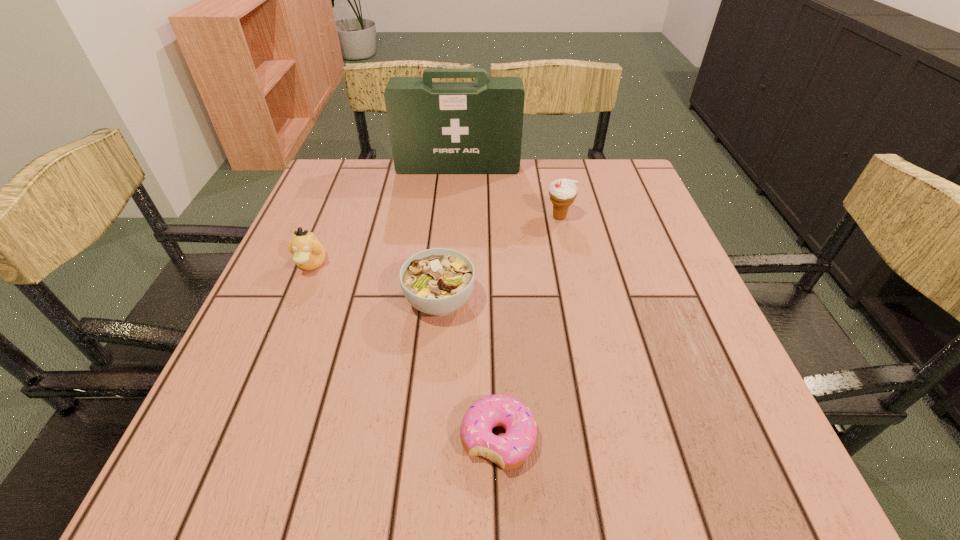
I want to click on the farthest object, so click(x=435, y=127).

The image size is (960, 540). What are the coordinates of `the first-aid kit` in the screenshot? It's located at (435, 127).

At what (x,y) coordinates should I click in order to perform the action: click on icecream. Please return your answer as a coordinate pair (x, y). The height and width of the screenshot is (540, 960). Looking at the image, I should click on 563,192.

Where is `the fourth nearest object`? The width and height of the screenshot is (960, 540). the fourth nearest object is located at coordinates (563, 192).

Where is `the leftmost object`? This screenshot has width=960, height=540. the leftmost object is located at coordinates (309, 254).

Where is `the third shortest object`? The height and width of the screenshot is (540, 960). the third shortest object is located at coordinates (309, 254).

I want to click on the second shortest object, so click(x=438, y=281).

In order to click on the shortest object in this screenshot , I will do `click(512, 449)`.

Locate an element on the screen. doughnut is located at coordinates (512, 449).

Locate an element on the screen. free region located 0.400m on the front-facing side of the tallest object is located at coordinates (450, 272).